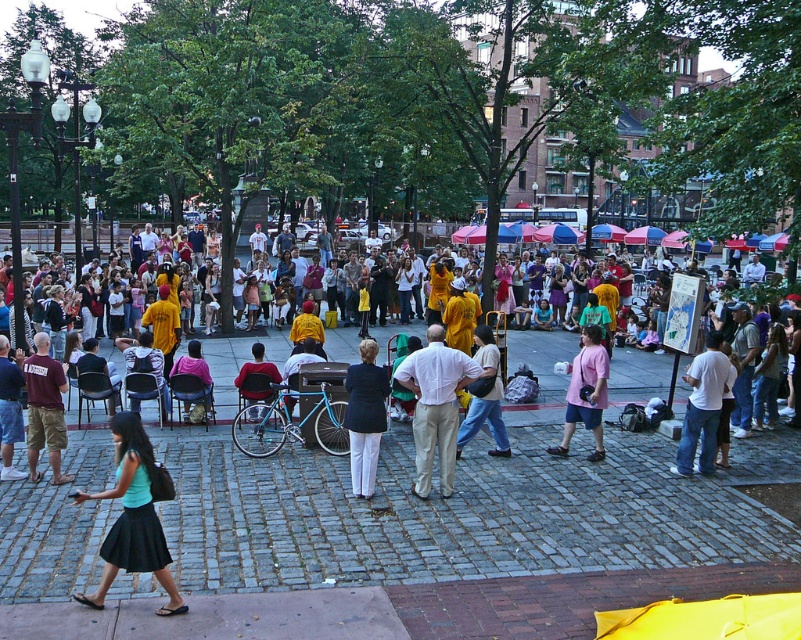
Question: Can you confirm if white cotton shirt at right is positioned above matte yellow shirt at center?

Choices:
 (A) yes
 (B) no

Answer: (B)

Question: Is white cotton shirt at center in front of maroon cotton shirt at left?

Choices:
 (A) no
 (B) yes

Answer: (B)

Question: Is the position of teal fabric skirt at lower left more distant than that of white cotton shirt at center?

Choices:
 (A) no
 (B) yes

Answer: (A)

Question: Among these objects, which one is nearest to the camera?

Choices:
 (A) matte black blazer at center
 (B) pink cotton shirt at center

Answer: (A)

Question: Estimate the real-world distances between objects in this image. Which object is closer to the matte yellow shirt at center?

Choices:
 (A) maroon cotton shirt at left
 (B) pink fabric dress at center

Answer: (A)

Question: Which of the following is the closest to the observer?

Choices:
 (A) (490, 333)
 (B) (598, 381)
 (C) (260, 371)

Answer: (B)